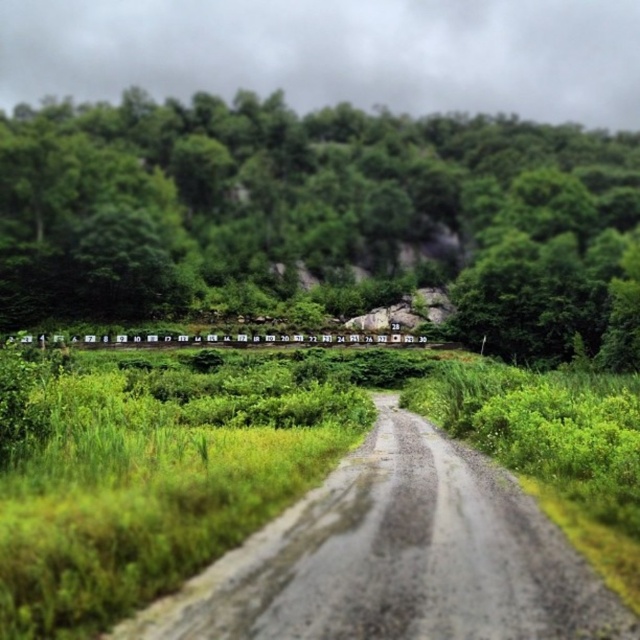
Question: Does green leafy tree at center lie behind gray gravel road at center?

Choices:
 (A) no
 (B) yes

Answer: (B)

Question: Can you confirm if green leafy tree at center is positioned below gray gravel road at center?

Choices:
 (A) yes
 (B) no

Answer: (B)

Question: Which point is farther from the camera taking this photo?

Choices:
 (A) (563, 317)
 (B) (204, 608)

Answer: (A)

Question: Does green leafy tree at center have a larger size compared to gray gravel road at center?

Choices:
 (A) yes
 (B) no

Answer: (A)

Question: Which point is closer to the camera?

Choices:
 (A) green leafy tree at center
 (B) gray gravel road at center

Answer: (B)

Question: Which object appears closest to the camera in this image?

Choices:
 (A) gray gravel road at center
 (B) green leafy tree at center

Answer: (A)